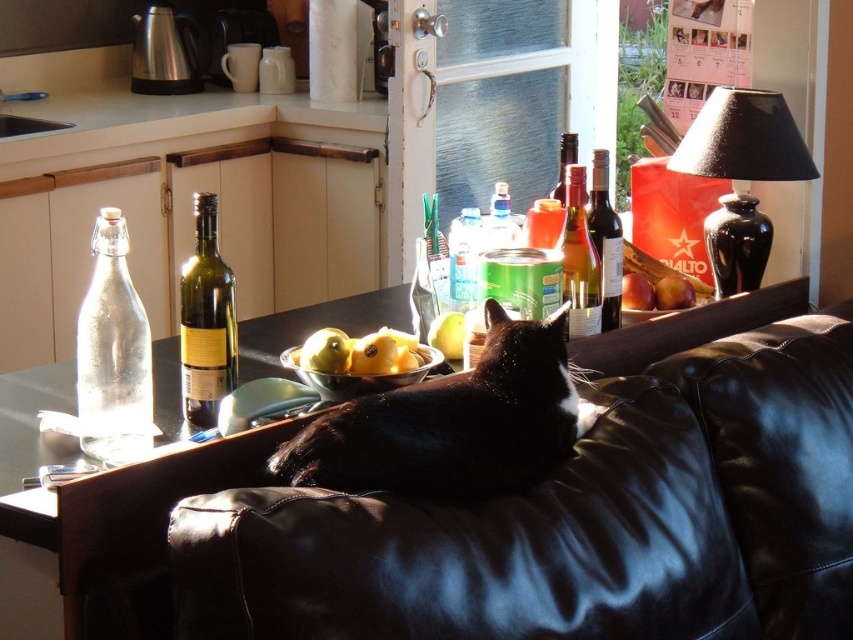
Question: Which object appears farthest from the camera in this image?

Choices:
 (A) translucent glass can at center
 (B) black ceramic lamp at upper right
 (C) yellow matte pears at center
 (D) black leather couch at lower center

Answer: (B)

Question: Is black leather couch at lower center to the right of black fur cat at center from the viewer's perspective?

Choices:
 (A) no
 (B) yes

Answer: (B)

Question: Is green glass bottle at center thinner than yellow matte pears at center?

Choices:
 (A) no
 (B) yes

Answer: (B)

Question: Which point is closer to the camera?

Choices:
 (A) dark glass wine bottle at center
 (B) black leather couch at lower center

Answer: (B)

Question: Does translucent glass can at center appear under red matte apple at couch top?

Choices:
 (A) yes
 (B) no

Answer: (B)

Question: Which object is the closest to the translucent glass wine bottle at center?

Choices:
 (A) transparent glass bottle at left
 (B) translucent glass can at center
 (C) yellow matte pear at center

Answer: (B)